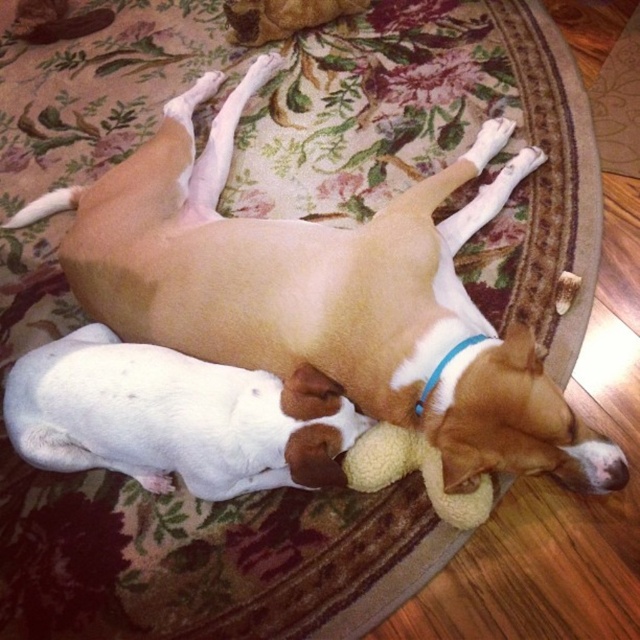
Looking at this image, you are a dog owner who wants to place a new small dog bed for the brown matte dog at center. The bed is 10 inches wide. The fluffy yellow toy at lower center is currently occupying some space. Based on their sizes, do you think the bed will fit comfortably next to the toy?

The brown matte dog at center is bigger than the fluffy yellow toy at lower center. Since the bed is 10 inches wide, it should fit comfortably next to the toy as the toy is smaller and the space around them can accommodate the bed.

You are a dog owner who wants to place a new squeaky toy between the brown matte dog at center and the fluffy yellow toy at lower center. The new toy is 3 inches long. Is there enough space between them to fit the new toy without overlapping?

The distance between the brown matte dog at center and the fluffy yellow toy at lower center is 11.69 inches. Since the new toy is only 3 inches long, there is sufficient space to place it between them without overlapping.

You are a photographer taking a picture of the two dogs on the rug. You want to focus on the point closer to the camera. Which point should you choose between point (x=209, y=362) and point (x=401, y=445)?

Point (x=209, y=362) is further to the camera than point (x=401, y=445), so you should choose point (x=209, y=362) to focus on the closer point.